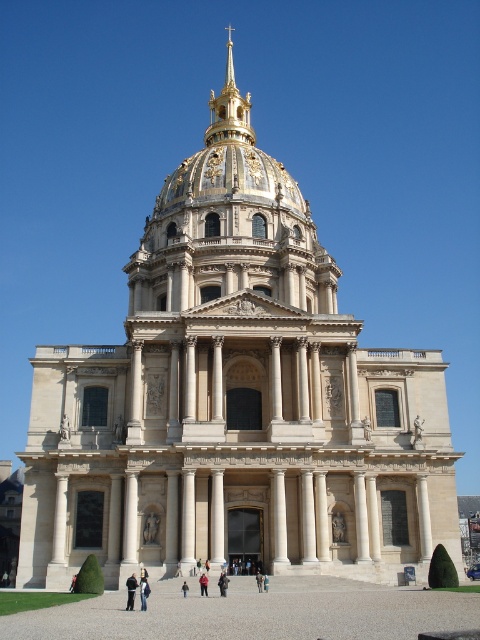
Does point (248, 138) come farther from viewer compared to point (182, 588)?

Yes.

Is gold/gilded metal spire at upper center further to the viewer compared to brown leather jacket at center?

Yes, gold/gilded metal spire at upper center is further from the viewer.

Between point (215, 136) and point (182, 593), which one is positioned in front?

Positioned in front is point (182, 593).

This screenshot has width=480, height=640. Find the location of `gold/gilded metal spire at upper center`. gold/gilded metal spire at upper center is located at coordinates (228, 108).

Can you confirm if dark blue jeans at center is positioned to the left of light brown leather jacket at center?

Correct, you'll find dark blue jeans at center to the left of light brown leather jacket at center.

What do you see at coordinates (131, 589) in the screenshot?
I see `dark blue jeans at center` at bounding box center [131, 589].

Is point (132, 577) closer to viewer compared to point (141, 602)?

No, (132, 577) is further to viewer.

Where is `dark blue jeans at center`? Image resolution: width=480 pixels, height=640 pixels. dark blue jeans at center is located at coordinates (131, 589).

Is gold/gilded metal spire at upper center smaller than red fabric person at center?

Actually, gold/gilded metal spire at upper center might be larger than red fabric person at center.

Which of these two, gold/gilded metal spire at upper center or red fabric person at center, stands shorter?

With less height is red fabric person at center.

Is point (230, 113) more distant than point (203, 595)?

Yes.

Identify the location of gold/gilded metal spire at upper center. Image resolution: width=480 pixels, height=640 pixels. (228, 108).